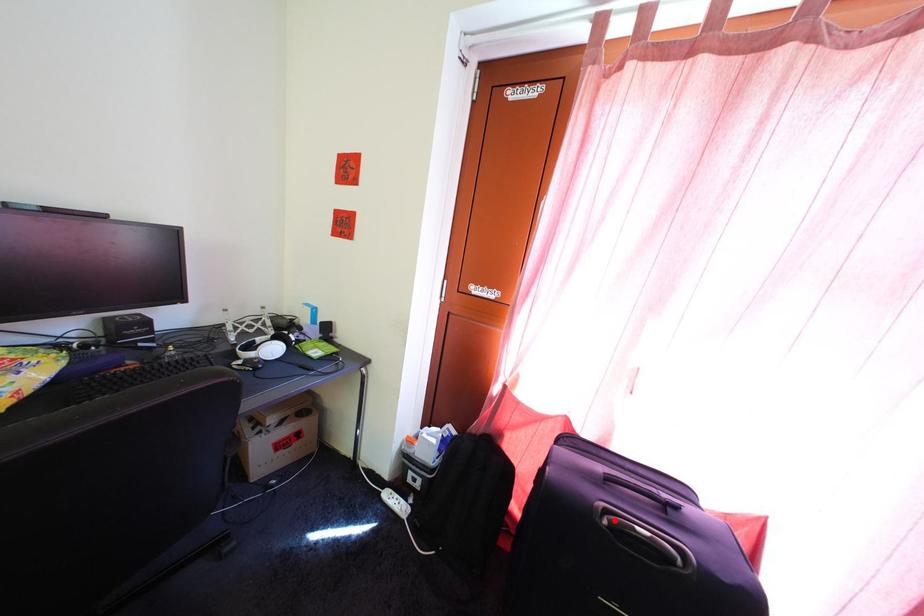
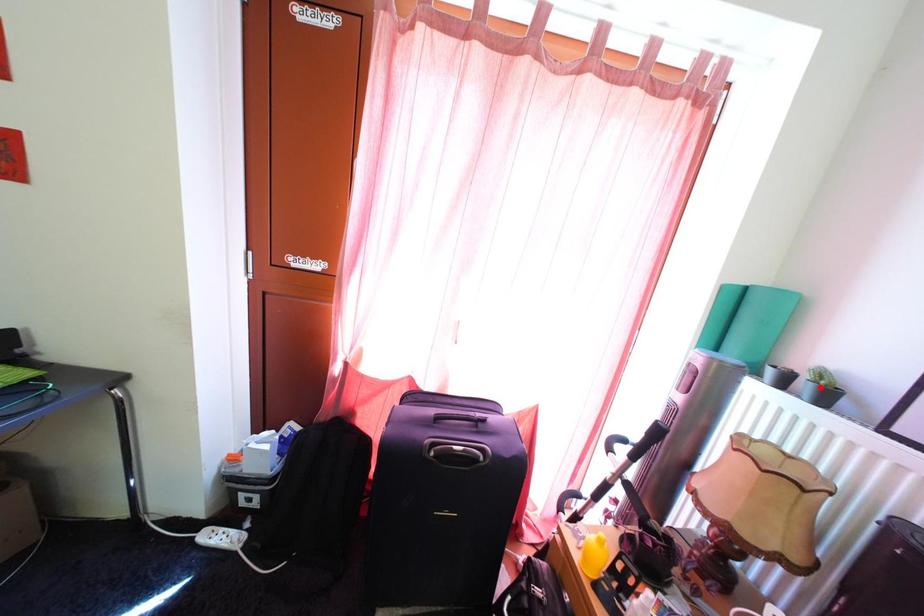
I am providing you with two images of the same scene from different viewpoints. A red point is marked on the first image and another point is marked on the second image. Does the point marked in image1 correspond to the same location as the one in image2?

No